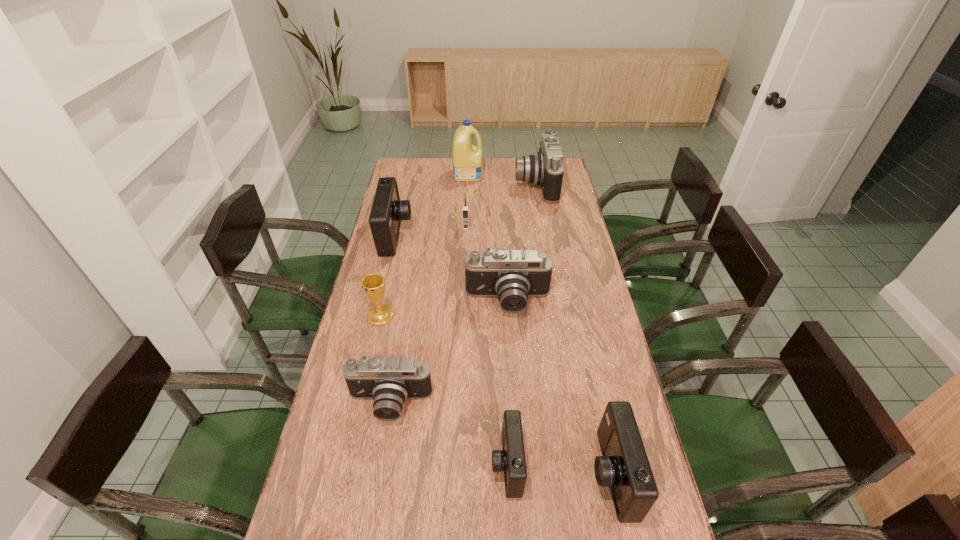
Locate an element on the screen. This screenshot has width=960, height=540. the third nearest camera is located at coordinates (388, 381).

Identify the location of the nearest black camera. The image size is (960, 540). (388, 381).

Where is `the smallest blue camera`? The height and width of the screenshot is (540, 960). the smallest blue camera is located at coordinates (511, 460).

Locate an element on the screen. The width and height of the screenshot is (960, 540). the shortest object is located at coordinates (511, 460).

Where is `vacant space located 0.360m on the label of the detergent`? Image resolution: width=960 pixels, height=540 pixels. vacant space located 0.360m on the label of the detergent is located at coordinates (555, 174).

Locate an element on the screen. This screenshot has height=540, width=960. free point located on the front-facing side of the farthest black camera is located at coordinates 453,184.

Where is `vacant area located on the front-facing side of the farthest black camera`? This screenshot has width=960, height=540. vacant area located on the front-facing side of the farthest black camera is located at coordinates (484, 184).

What are the coordinates of `vacant space located 0.280m on the front-facing side of the farthest black camera` in the screenshot? It's located at (457, 184).

You are a GUI agent. You are given a task and a screenshot of the screen. Output one action in this format:
    pyautogui.click(x=<x>, y=<y>)
    Task: Click on the free space located 0.200m on the front-facing side of the farthest blue camera
    The height and width of the screenshot is (540, 960).
    Given the screenshot: What is the action you would take?
    pyautogui.click(x=460, y=236)

The image size is (960, 540). What are the coordinates of `vacant space located on the front-facing side of the second farthest black camera` in the screenshot? It's located at (513, 377).